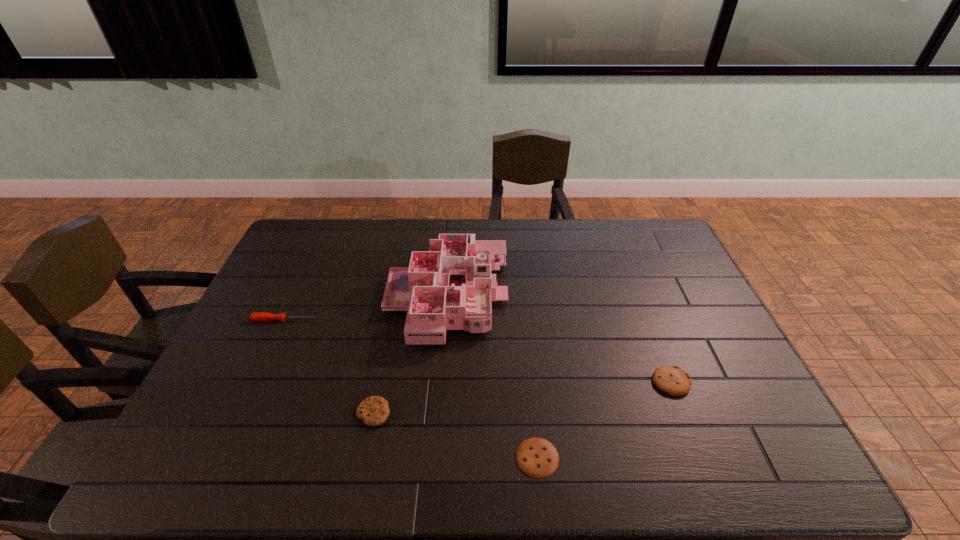
This screenshot has height=540, width=960. What are the coordinates of `free space located 0.210m at the tip of the leftmost object` in the screenshot? It's located at (386, 320).

This screenshot has width=960, height=540. Identify the location of vacant space situated 0.230m on the right of the second farthest cookie. click(483, 413).

Locate an element on the screen. vacant point located 0.070m on the left of the nearest object is located at coordinates (486, 457).

You are a GUI agent. You are given a task and a screenshot of the screen. Output one action in this format:
    pyautogui.click(x=<x>, y=<y>)
    Task: Click on the object at the far edge
    
    Given the screenshot: What is the action you would take?
    pyautogui.click(x=450, y=287)

Identify the location of object present at the near edge. (538, 458).

The width and height of the screenshot is (960, 540). I want to click on object present at the left edge, so click(262, 316).

Image resolution: width=960 pixels, height=540 pixels. In order to click on object that is at the right edge in this screenshot , I will do pyautogui.click(x=674, y=381).

Find the location of a particular element. The image size is (960, 540). vacant area at the far edge of the desktop is located at coordinates (623, 240).

The width and height of the screenshot is (960, 540). In order to click on vacant space at the near edge in this screenshot , I will do `click(264, 470)`.

In the image, there is a desktop. Where is `vacant area at the left edge`? The width and height of the screenshot is (960, 540). vacant area at the left edge is located at coordinates (300, 285).